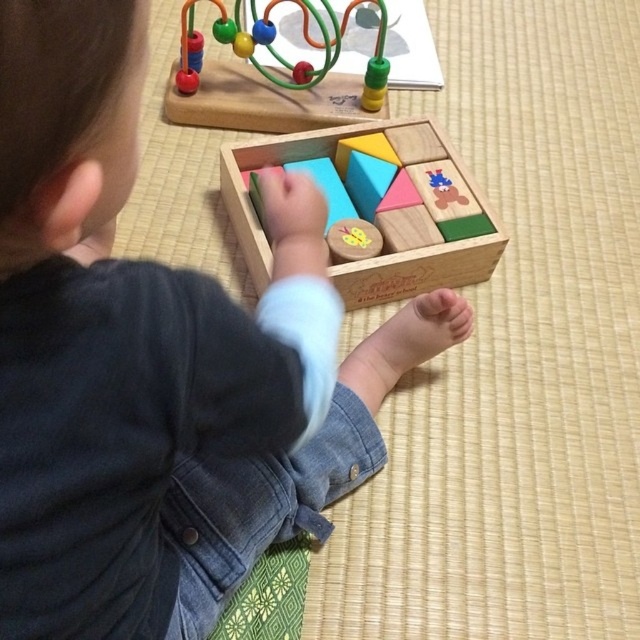
Which is above, wooden bead maze at upper center or wooden block set at center?

wooden bead maze at upper center is higher up.

Which of these two, wooden bead maze at upper center or wooden block set at center, stands taller?

With more height is wooden block set at center.

Describe the element at coordinates (272, 77) in the screenshot. I see `wooden bead maze at upper center` at that location.

Find the location of a particular element. This screenshot has height=640, width=640. wooden bead maze at upper center is located at coordinates (272, 77).

Does denim jacket at lower center come behind wooden bead maze at upper center?

No, it is not.

Between point (284, 444) and point (220, 106), which one is positioned behind?

The point (220, 106) is more distant.

You are a GUI agent. You are given a task and a screenshot of the screen. Output one action in this format:
    pyautogui.click(x=<x>, y=<y>)
    Task: Click on the denim jacket at lower center
    
    Given the screenshot: What is the action you would take?
    pyautogui.click(x=154, y=358)

Can you confirm if denim jacket at lower center is bigger than wooden block set at center?

Yes, denim jacket at lower center is bigger than wooden block set at center.

This screenshot has width=640, height=640. Identify the location of denim jacket at lower center. (154, 358).

What are the coordinates of `denim jacket at lower center` in the screenshot? It's located at (154, 358).